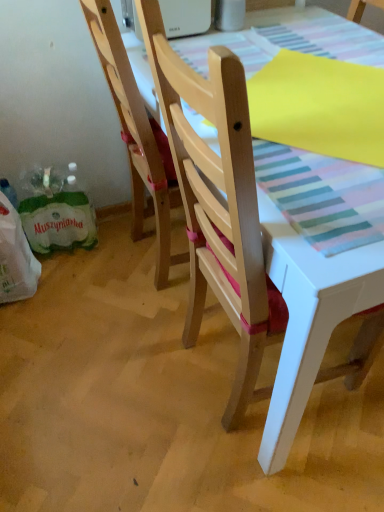
You are a GUI agent. You are given a task and a screenshot of the screen. Output one action in this format:
    pyautogui.click(x=<x>, y=<y>)
    Task: Click on the vacant space that is in between natural wood chair at center, arranged as the second chair when viewed from the right, and green paper shopping bag at lower left
    
    Given the screenshot: What is the action you would take?
    pyautogui.click(x=93, y=264)